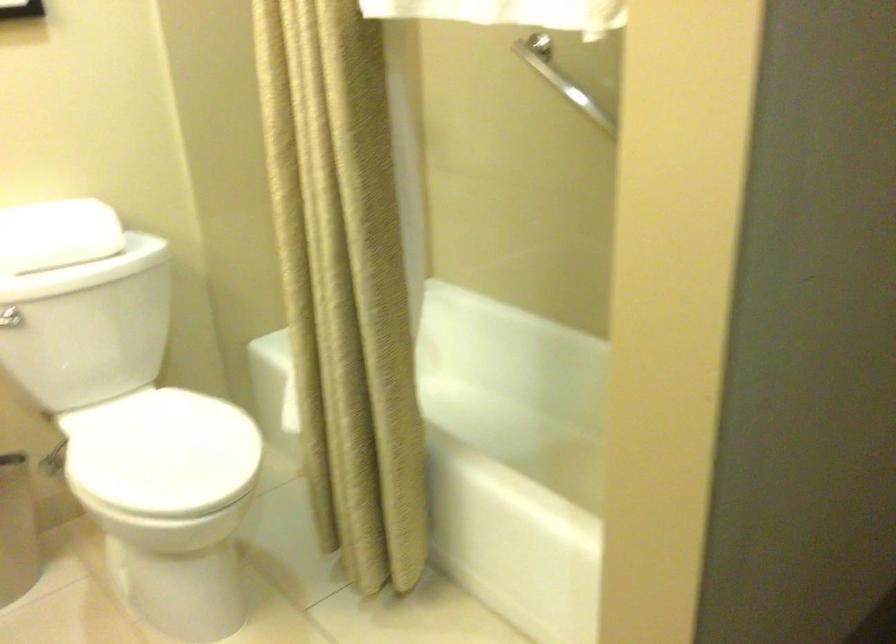
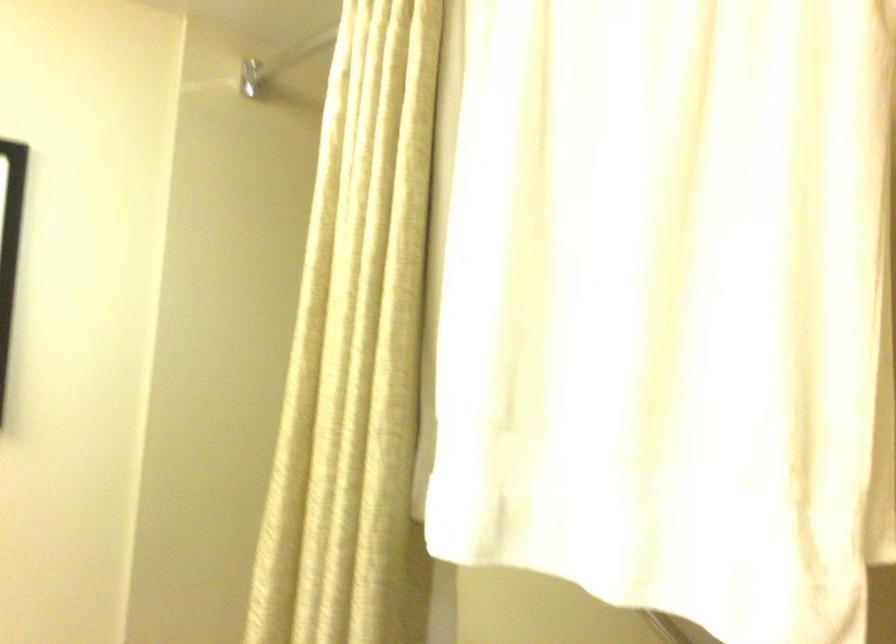
Consider the image. What movement of the cameraman would produce the second image?

The cameraman moved toward left, forward.